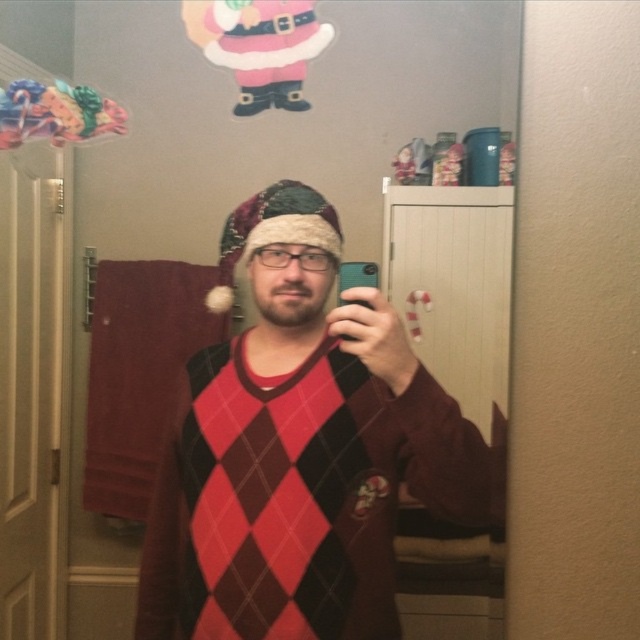
You are trying to frame a photo of the person in the bathroom scene. The fuzzy fabric santa hat at center is at point (x=273, y=230). If you want to position the hat exactly in the center of the photo, what adjustment should you make to the camera angle?

Since the fuzzy fabric santa hat at center is already located at point (x=273, y=230), which is the center of the photo, no adjustment is needed to the camera angle to keep it centered.

You are trying to take a selfie with your phone, but you notice your hat is blocking the camera view. Which item, the fuzzy fabric santa hat at center or the black plastic phone at center, is positioned higher and causing the obstruction?

The fuzzy fabric santa hat at center is taller than the black plastic phone at center, so it is positioned higher and causing the obstruction.